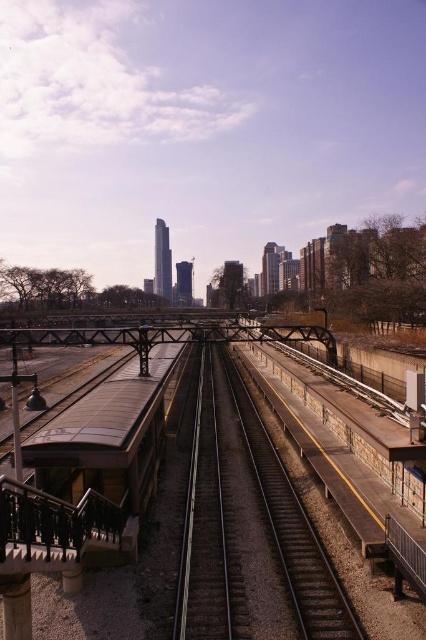
Who is positioned more to the left, smooth steel tracks at center or brown wooden passenger train at left?

brown wooden passenger train at left

Where is `smooth steel tracks at center`? smooth steel tracks at center is located at coordinates (249, 529).

Where is `smooth steel tracks at center`? The image size is (426, 640). smooth steel tracks at center is located at coordinates (249, 529).

Identify the location of smooth steel tracks at center. (249, 529).

Is point (8, 556) farther from camera compared to point (310, 550)?

No, (8, 556) is closer to viewer.

Can you confirm if concrete platform at center is positioned to the right of smooth steel tracks at center?

Incorrect, concrete platform at center is not on the right side of smooth steel tracks at center.

Is point (109, 435) closer to camera compared to point (189, 584)?

That is False.

This screenshot has height=640, width=426. I want to click on concrete platform at center, so click(x=176, y=497).

Between concrete platform at center and brown wooden passenger train at left, which one appears on the left side from the viewer's perspective?

From the viewer's perspective, brown wooden passenger train at left appears more on the left side.

Is concrete platform at center smaller than brown wooden passenger train at left?

Incorrect, concrete platform at center is not smaller in size than brown wooden passenger train at left.

Is point (247, 490) behind point (157, 374)?

No, it is in front of (157, 374).

You are a GUI agent. You are given a task and a screenshot of the screen. Output one action in this format:
    pyautogui.click(x=<x>, y=<y>)
    Task: Click on the concrete platform at center
    The image size is (426, 640).
    Given the screenshot: What is the action you would take?
    pyautogui.click(x=176, y=497)